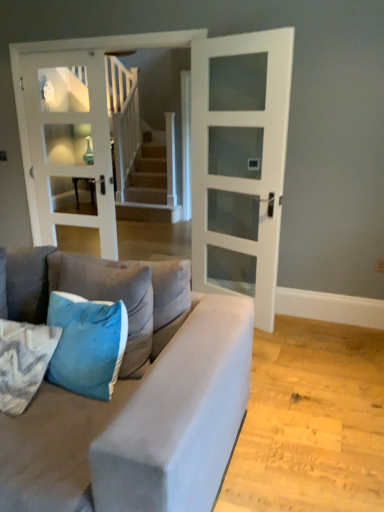
Question: Considering the relative sizes of white glass door at center, the 2th door in the right-to-left sequence, and blue fabric pillow at lower left, which is the 1th pillow in left-to-right order, in the image provided, is white glass door at center, the 2th door in the right-to-left sequence, taller than blue fabric pillow at lower left, which is the 1th pillow in left-to-right order,?

Choices:
 (A) no
 (B) yes

Answer: (B)

Question: Considering the relative positions of white glass door at center, which is counted as the first door, starting from the left, and blue fabric pillow at lower left, which is the 1th pillow in left-to-right order, in the image provided, is white glass door at center, which is counted as the first door, starting from the left, to the left of blue fabric pillow at lower left, which is the 1th pillow in left-to-right order, from the viewer's perspective?

Choices:
 (A) no
 (B) yes

Answer: (B)

Question: Considering the relative sizes of white glass door at center, the 2th door in the right-to-left sequence, and blue fabric pillow at lower left, which is the 3th pillow from right to left, in the image provided, is white glass door at center, the 2th door in the right-to-left sequence, wider than blue fabric pillow at lower left, which is the 3th pillow from right to left,?

Choices:
 (A) no
 (B) yes

Answer: (A)

Question: Is white glass door at center, the 2th door in the right-to-left sequence, placed right next to blue fabric pillow at lower left, which is the 3th pillow from right to left?

Choices:
 (A) yes
 (B) no

Answer: (B)

Question: Could blue fabric pillow at lower left, which is the 1th pillow in left-to-right order, be considered to be inside white glass door at center, which is counted as the first door, starting from the left?

Choices:
 (A) no
 (B) yes

Answer: (A)

Question: Considering the positions of suede gray couch at lower left and velvet blue pillow at lower left, the first pillow when ordered from right to left, in the image, is suede gray couch at lower left taller or shorter than velvet blue pillow at lower left, the first pillow when ordered from right to left,?

Choices:
 (A) short
 (B) tall

Answer: (B)

Question: Considering their positions, is suede gray couch at lower left located in front of or behind velvet blue pillow at lower left, the first pillow when ordered from right to left?

Choices:
 (A) behind
 (B) front

Answer: (B)

Question: Looking at the image, does suede gray couch at lower left seem bigger or smaller compared to velvet blue pillow at lower left, the third pillow in the left-to-right sequence?

Choices:
 (A) small
 (B) big

Answer: (B)

Question: Considering the positions of point (135, 266) and point (87, 280), is point (135, 266) closer or farther from the camera than point (87, 280)?

Choices:
 (A) closer
 (B) farther

Answer: (B)

Question: Looking at the image, does white glass door at center, the 2th door when ordered from left to right, seem bigger or smaller compared to teal velvet pillow at lower left, marked as the 2th pillow in a left-to-right arrangement?

Choices:
 (A) small
 (B) big

Answer: (B)

Question: From their relative heights in the image, would you say white glass door at center, the 2th door when ordered from left to right, is taller or shorter than teal velvet pillow at lower left, marked as the 2th pillow in a left-to-right arrangement?

Choices:
 (A) short
 (B) tall

Answer: (B)

Question: Considering the positions of point (206, 59) and point (125, 328), is point (206, 59) closer or farther from the camera than point (125, 328)?

Choices:
 (A) farther
 (B) closer

Answer: (A)

Question: Looking at their shapes, would you say white glass door at center, which is counted as the 1th door, starting from the right, is wider or thinner than teal velvet pillow at lower left, marked as the 2th pillow in a left-to-right arrangement?

Choices:
 (A) wide
 (B) thin

Answer: (B)

Question: Is velvet blue pillow at lower left, the third pillow in the left-to-right sequence, bigger or smaller than white glass door at center, which is counted as the first door, starting from the left?

Choices:
 (A) big
 (B) small

Answer: (B)

Question: Considering the positions of point (135, 287) and point (97, 195), is point (135, 287) closer or farther from the camera than point (97, 195)?

Choices:
 (A) farther
 (B) closer

Answer: (B)